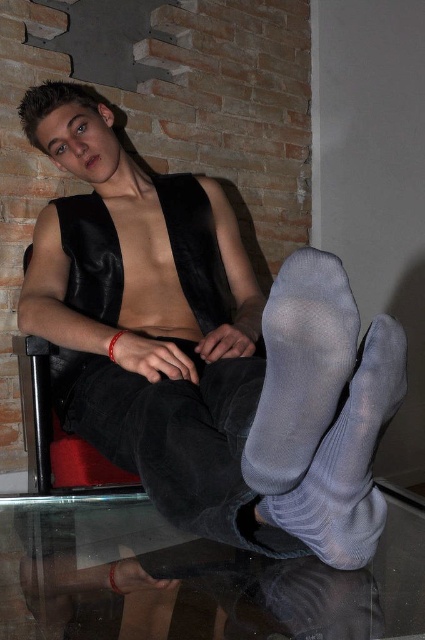
Between satin black vest at upper center and gray knitted sock at lower center, which one is positioned lower?

gray knitted sock at lower center is lower down.

Does satin black vest at upper center appear on the right side of gray knitted sock at lower center?

Incorrect, satin black vest at upper center is not on the right side of gray knitted sock at lower center.

Who is more forward, (283,381) or (376,531)?

Point (283,381)

You are a GUI agent. You are given a task and a screenshot of the screen. Output one action in this format:
    pyautogui.click(x=<x>, y=<y>)
    Task: Click on the satin black vest at upper center
    The width and height of the screenshot is (425, 640).
    Given the screenshot: What is the action you would take?
    pyautogui.click(x=206, y=349)

Between satin black vest at upper center and gray mesh socks at lower center, which one appears on the right side from the viewer's perspective?

From the viewer's perspective, gray mesh socks at lower center appears more on the right side.

Who is more forward, (231, 456) or (291, 280)?

Point (291, 280) is in front.

Locate an element on the screen. satin black vest at upper center is located at coordinates (206, 349).

Does point (308, 266) lie in front of point (331, 560)?

Yes.

Does point (314, 380) come behind point (348, 488)?

No, (314, 380) is closer to viewer.

Find the location of a particular element. This screenshot has width=425, height=640. gray mesh socks at lower center is located at coordinates (300, 369).